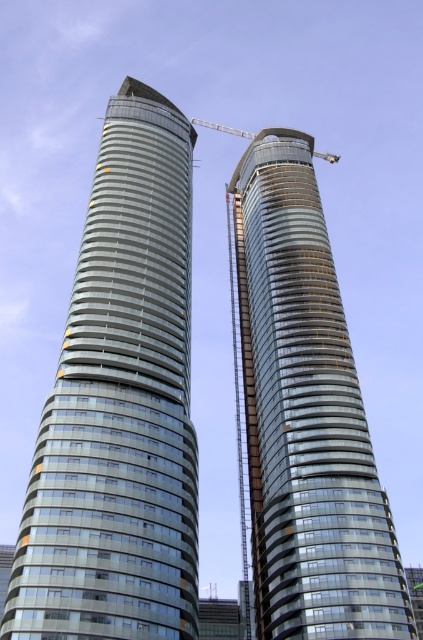
Question: Considering the real-world distances, which object is closest to the metallic gray crane at upper center?

Choices:
 (A) glassy metallic skyscraper at left
 (B) glassy metallic skyscraper at center

Answer: (B)

Question: Can you confirm if glassy metallic skyscraper at left is bigger than glassy metallic skyscraper at center?

Choices:
 (A) no
 (B) yes

Answer: (A)

Question: Which of these objects is positioned closest to the glassy metallic skyscraper at left?

Choices:
 (A) glassy metallic skyscraper at center
 (B) metallic gray crane at upper center

Answer: (A)

Question: Is glassy metallic skyscraper at center to the right of metallic gray crane at upper center from the viewer's perspective?

Choices:
 (A) no
 (B) yes

Answer: (A)

Question: Among these points, which one is farthest from the camera?

Choices:
 (A) (181, 593)
 (B) (266, 291)
 (C) (195, 124)

Answer: (C)

Question: Is glassy metallic skyscraper at left further to camera compared to metallic gray crane at upper center?

Choices:
 (A) yes
 (B) no

Answer: (B)